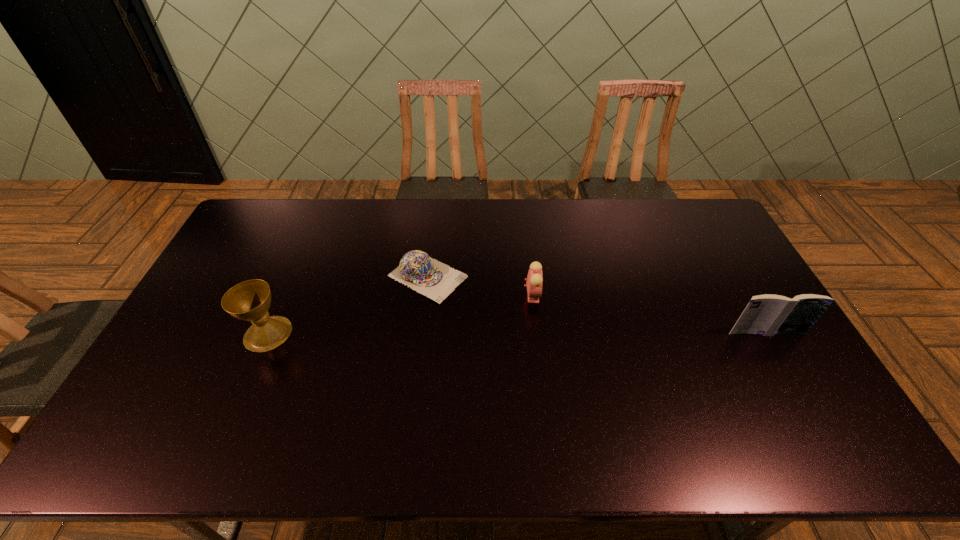
Where is `free space between the alarm clock and the cap`? This screenshot has width=960, height=540. free space between the alarm clock and the cap is located at coordinates (480, 286).

The width and height of the screenshot is (960, 540). What are the coordinates of `free space between the third object from right to left and the rightmost object` in the screenshot? It's located at (597, 305).

I want to click on vacant area that lies between the leftmost object and the book, so click(x=517, y=333).

Locate an element on the screen. vacant region between the second shortest object and the shortest object is located at coordinates (480, 286).

Locate an element on the screen. This screenshot has height=540, width=960. free point between the third object from left to right and the book is located at coordinates (649, 314).

Identify the location of blank region between the third tallest object and the book. The width and height of the screenshot is (960, 540). (649, 314).

Locate an element on the screen. The height and width of the screenshot is (540, 960). vacant area that lies between the second shortest object and the leftmost object is located at coordinates (400, 314).

Locate an element on the screen. The height and width of the screenshot is (540, 960). unoccupied position between the book and the chalice is located at coordinates (517, 333).

At what (x,y) coordinates should I click in order to perform the action: click on vacant area that lies between the chalice and the rightmost object. Please return your answer as a coordinate pair (x, y). Image resolution: width=960 pixels, height=540 pixels. Looking at the image, I should click on (517, 333).

Where is `object that is the second closest to the chalice`? The width and height of the screenshot is (960, 540). object that is the second closest to the chalice is located at coordinates (534, 279).